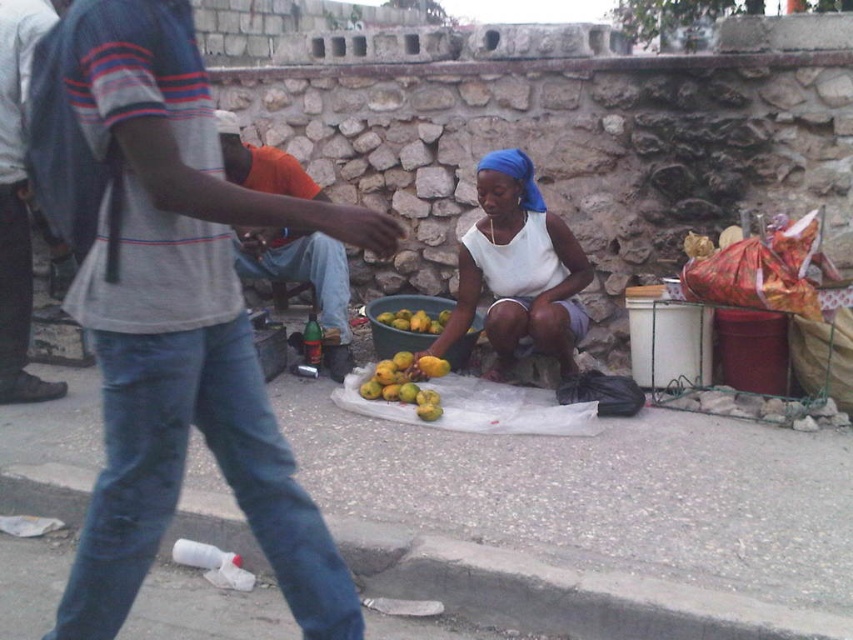
You are a customer looking to buy mangoes from the woman. You see the white matte tank top at center and the yellow matte mangoes at center. Which item is located to the right of the other?

The white matte tank top at center is positioned on the right side of yellow matte mangoes at center, so the tank top is to the right of the mangoes.

You are standing on the smooth concrete pavement at center and looking up at the white matte tank top at center. Which object is closer to you?

The smooth concrete pavement at center is positioned under the white matte tank top at center, so the white matte tank top at center is closer to you.